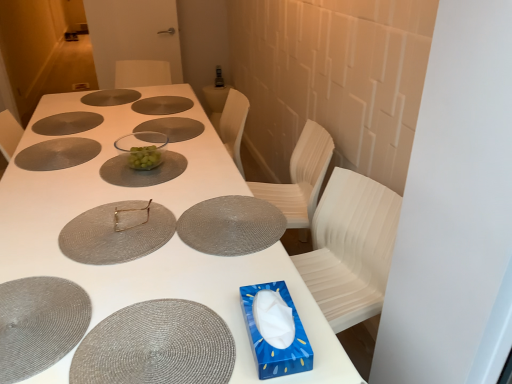
Question: In the image, is matte gray glass plate at upper center, which is the 9th glass plate from front to back, on the left side or the right side of white matte table at center?

Choices:
 (A) right
 (B) left

Answer: (B)

Question: From a real-world perspective, is matte gray glass plate at upper center, which ranks as the 1th glass plate in back-to-front order, positioned above or below white matte table at center?

Choices:
 (A) above
 (B) below

Answer: (A)

Question: Based on their relative distances, which object is farther from the matte gray glass plate at upper left, the fifth glass plate when ordered from front to back?

Choices:
 (A) white matte table at center
 (B) matte gray placemat at center, placed as the third glass plate when sorted from front to back
 (C) transparent glass bowl at center, acting as the sixth glass plate starting from the back
 (D) matte gray glass plate at upper left, the third glass plate in the back-to-front sequence
 (E) matte gray glass plate at upper center, which is the 9th glass plate from front to back

Answer: (B)

Question: Which is farther from the white matte table at center?

Choices:
 (A) matte gray glass plate at center, which is the 2th glass plate in back-to-front order
 (B) woven gray placemat at lower left
 (C) matte gray glass plate at upper center, which is the 9th glass plate from front to back
 (D) matte gray glass plate at upper left, the fifth glass plate when ordered from front to back
 (E) matte gray glass plate at upper left, the third glass plate in the back-to-front sequence

Answer: (C)